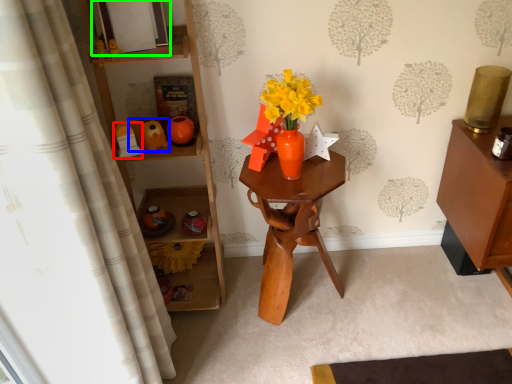
Question: Estimate the real-world distances between objects in this image. Which object is farther from toy (highlighted by a red box), toy (highlighted by a blue box) or picture frame (highlighted by a green box)?

Choices:
 (A) toy
 (B) picture frame

Answer: (B)